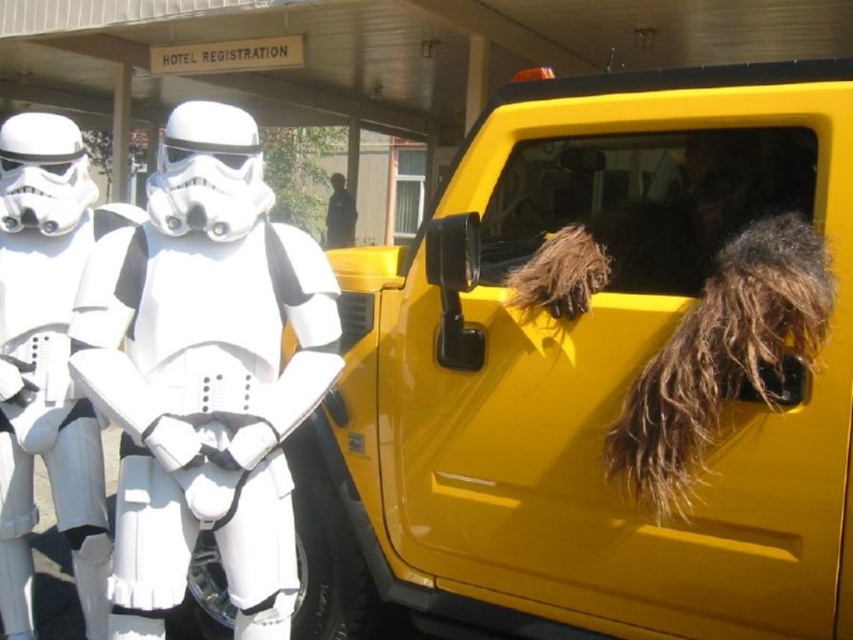
From the picture: You are planning to take a photo of the two stormtroopers, the white matte stormtrooper at center and the white plastic stormtrooper at left. Which one should you focus on if you want to capture the wider one in your shot?

The white matte stormtrooper at center is wider than the white plastic stormtrooper at left, so you should focus on the white matte stormtrooper at center to capture the wider one in your shot.

Please describe the location of the point labeled as point (601,372) in the image. What object is it on?

The point (601,372) is located on the yellow matte car at right.

You are a photographer trying to capture the yellow matte car at right in your shot. There is a Stormtrooper at point (x=601, y=372) blocking your view. Can you move the Stormtrooper to the left to get a clear shot of the car?

The point (x=601, y=372) is where the yellow matte car at right is located, so moving the Stormtrooper there would not block the view. The Stormtrooper is already at the location of the car, so there is no obstruction.